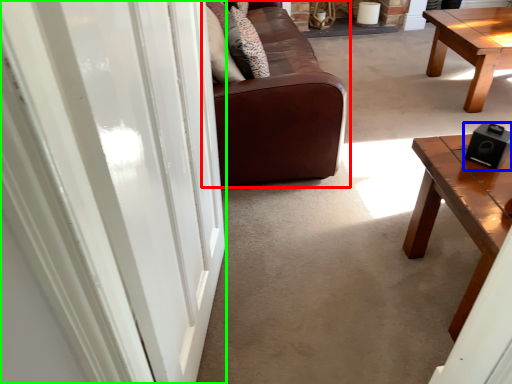
Question: Based on their relative distances, which object is farther from studio couch (highlighted by a red box)? Choose from speaker (highlighted by a blue box) and screen door (highlighted by a green box).

Choices:
 (A) speaker
 (B) screen door

Answer: (B)